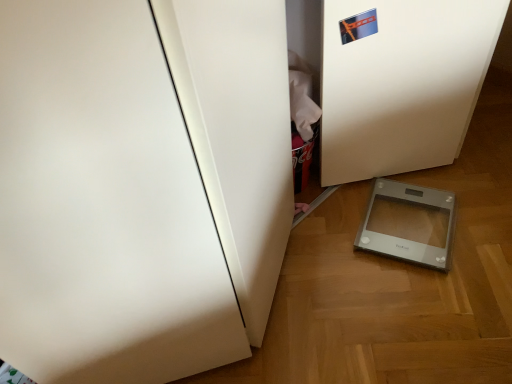
The height and width of the screenshot is (384, 512). Describe the element at coordinates (408, 223) in the screenshot. I see `transparent plastic scale at lower right` at that location.

I want to click on transparent plastic scale at lower right, so click(x=408, y=223).

What is the approximate height of transparent plastic scale at lower right?

The height of transparent plastic scale at lower right is 1.56 inches.

In order to click on transparent plastic scale at lower right in this screenshot , I will do `click(408, 223)`.